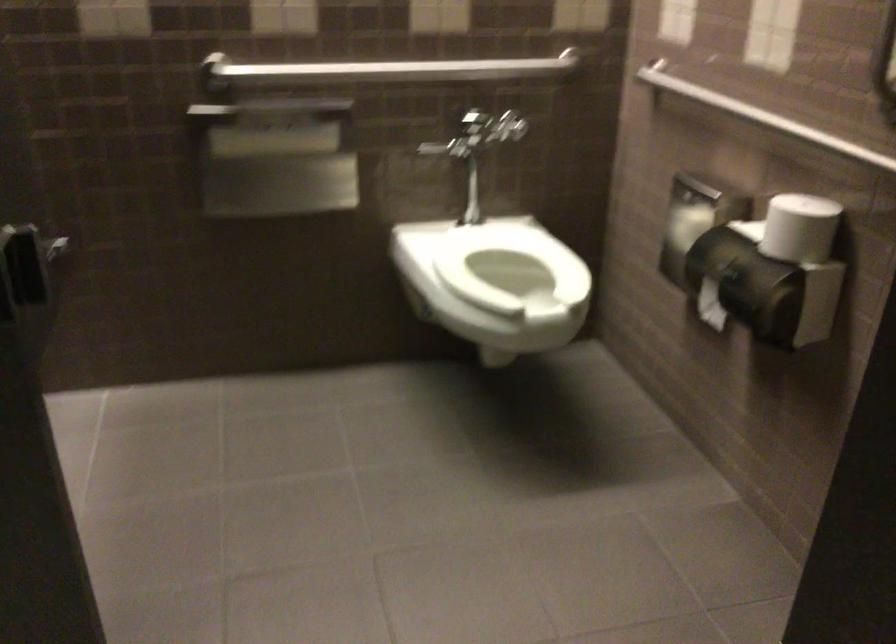
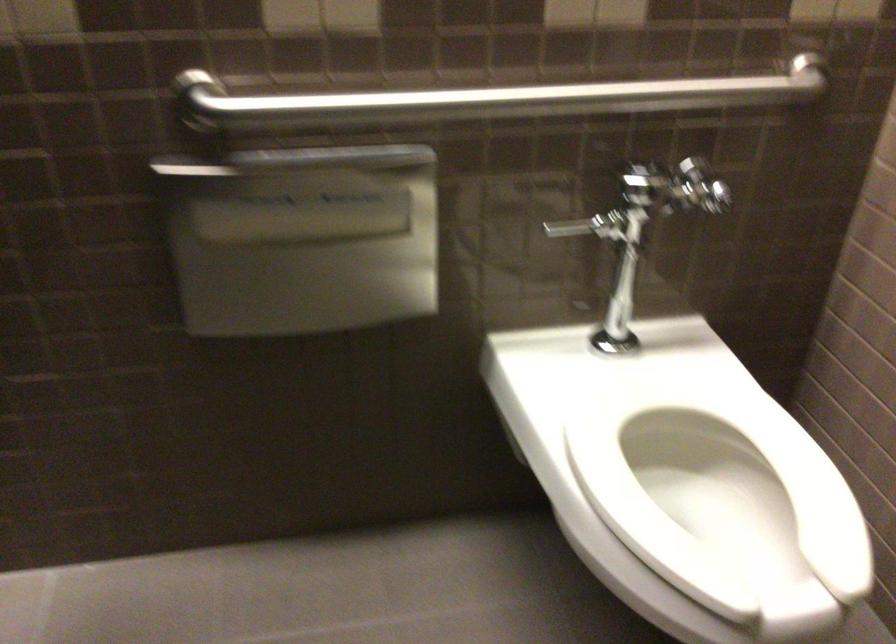
Locate, in the second image, the point that corresponds to (x=532, y=305) in the first image.

(719, 494)